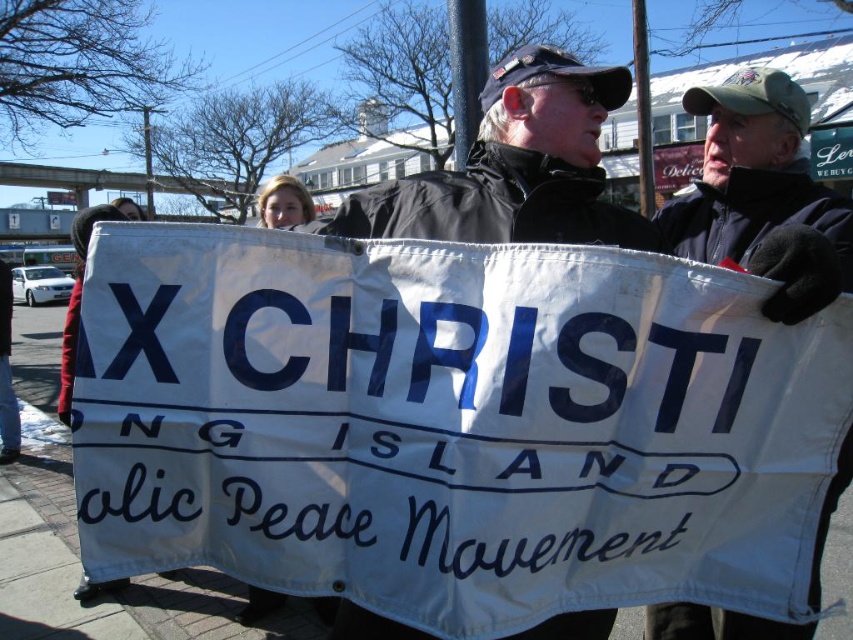
You are a photographer trying to capture a clear shot of the two individuals holding the banner. You notice that one of them is wearing a black jacket at center and the other is wearing a black fleece jacket at center. Which person should you focus on if you want to photograph someone wearing a smaller garment?

The black jacket at center has a smaller size compared to the black fleece jacket at center, so you should focus on the person wearing the black jacket at center.

You are organizing a clothing donation drive and need to categorize the jackets based on their size. Which of the two jackets, the black jacket at center or the black fleece jacket at center, is wider?

The black jacket at center is wider than the black fleece jacket at center.

You are a photographer standing at the edge of the protest group. You want to take a photo of both the black jacket at center and the black fleece jacket at center in the same frame. The camera you are using has a maximum focus range of 16 inches. Can you capture both jackets in focus without moving closer?

The black jacket at center and black fleece jacket at center are 16.54 inches apart from each other. Since the distance between them exceeds the camera maximum focus range of 16 inches, you cannot capture both jackets in focus without moving closer.